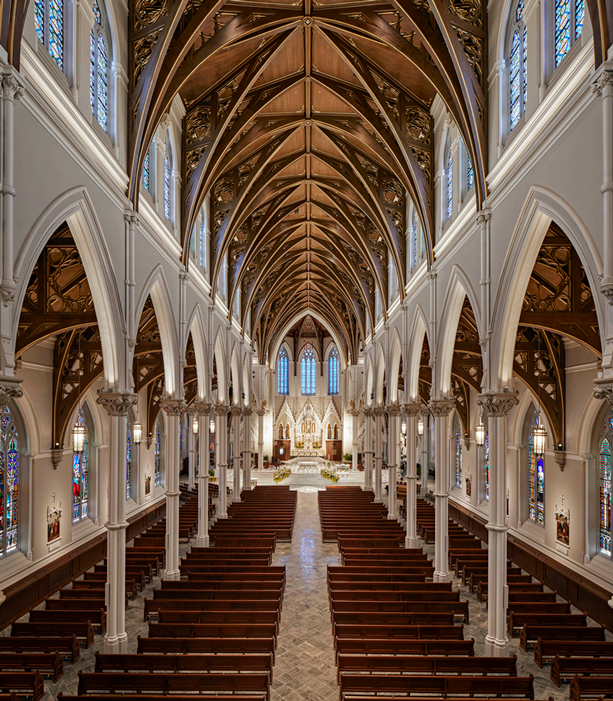
I want to click on bench, so click(x=370, y=619).